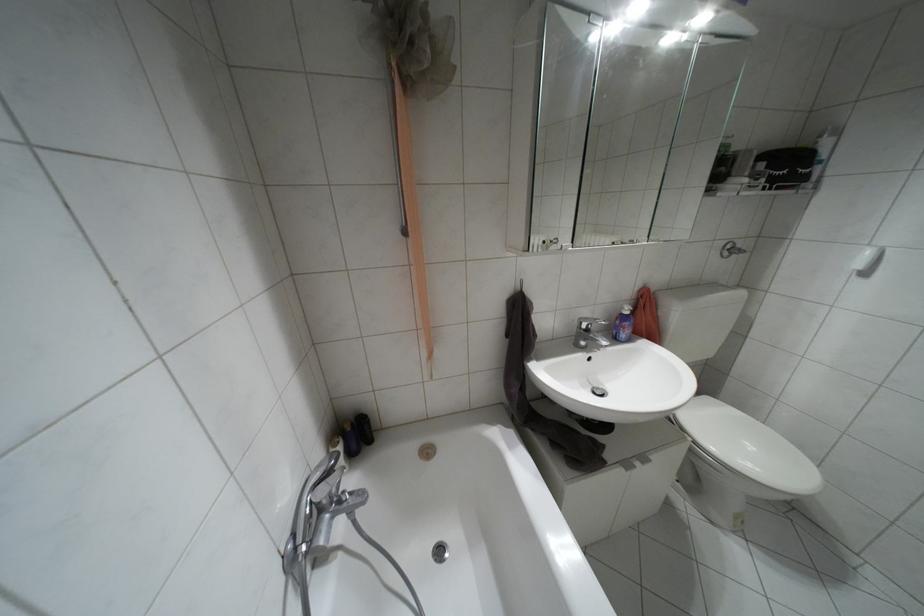
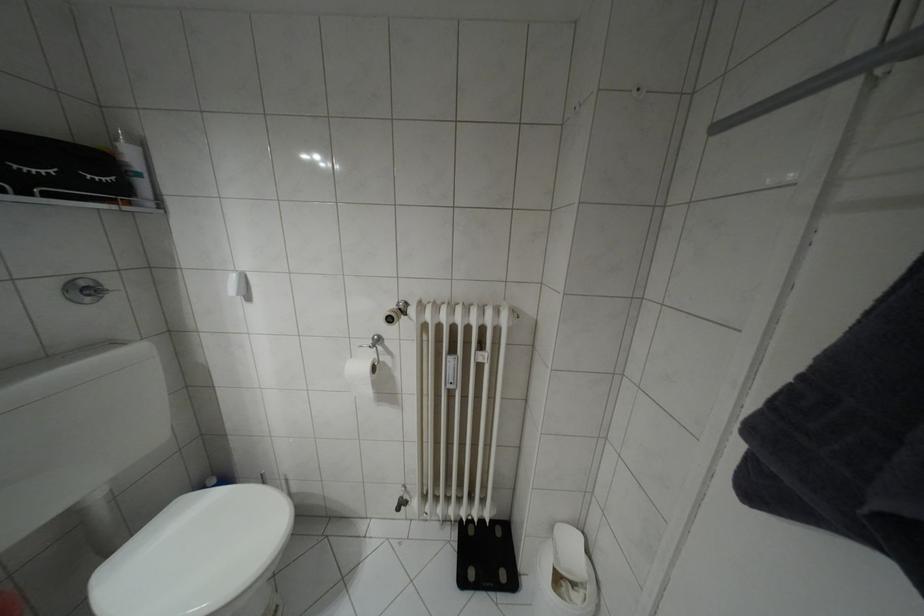
In the second image, find the point that corresponds to point 820,136 in the first image.

(116, 139)